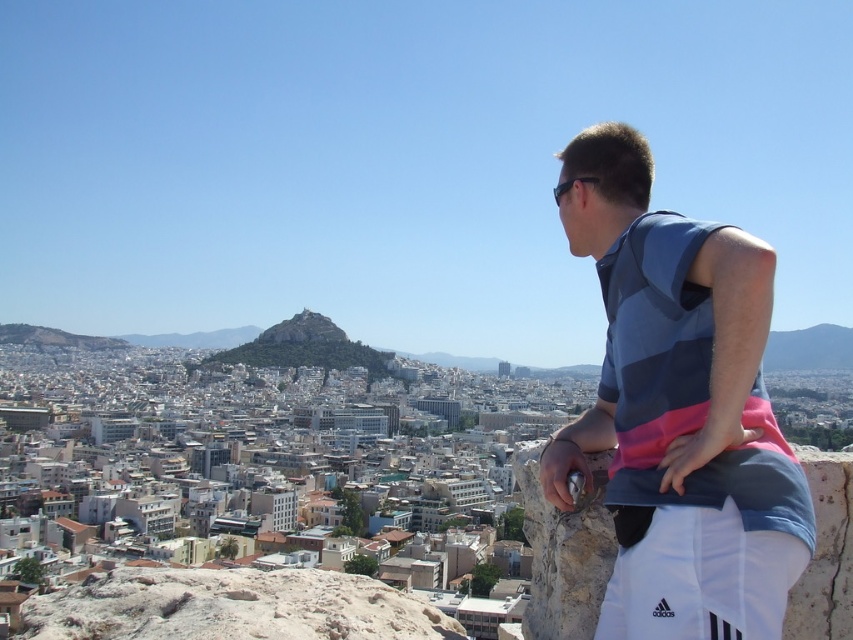
You are a photographer planning to take a portrait of the person wearing the blue striped sleeveless shirt at right from your current position. Given that your camera has a maximum focus range of 40 meters, will you be able to capture a clear image of the shirt?

The blue striped sleeveless shirt at right is 41.15 meters away from the camera. Since the camera can only focus up to 40 meters, it won